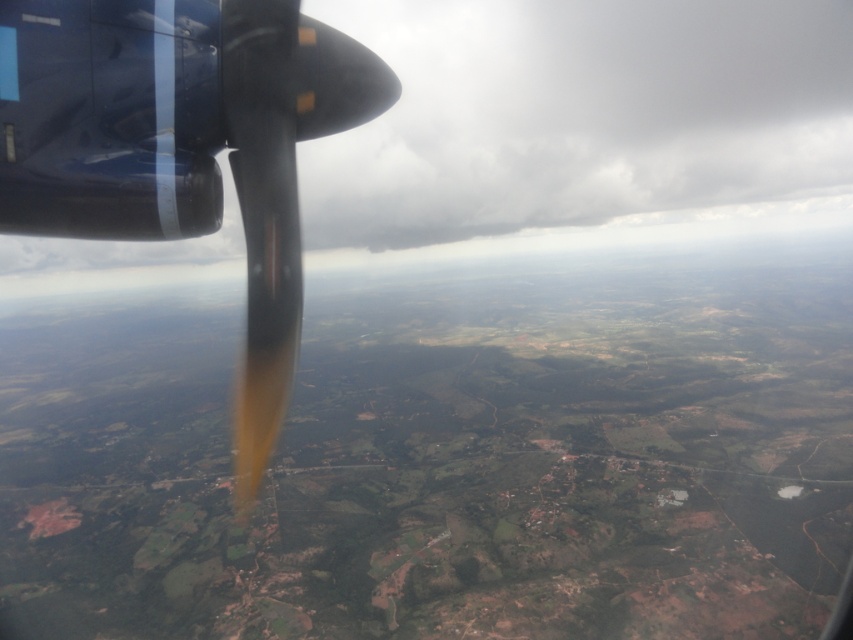
Question: Is the position of matte black propeller at upper left more distant than that of shiny metallic propeller at upper left?

Choices:
 (A) no
 (B) yes

Answer: (B)

Question: Does matte black propeller at upper left have a larger size compared to shiny metallic propeller at upper left?

Choices:
 (A) yes
 (B) no

Answer: (A)

Question: Among these objects, which one is nearest to the camera?

Choices:
 (A) shiny metallic propeller at upper left
 (B) matte black propeller at upper left

Answer: (A)

Question: Is matte black propeller at upper left to the right of shiny metallic propeller at upper left from the viewer's perspective?

Choices:
 (A) no
 (B) yes

Answer: (B)

Question: Which object is closer to the camera taking this photo?

Choices:
 (A) shiny metallic propeller at upper left
 (B) matte black propeller at upper left

Answer: (A)

Question: Which of the following is the farthest from the observer?

Choices:
 (A) (386, 93)
 (B) (816, 122)

Answer: (B)